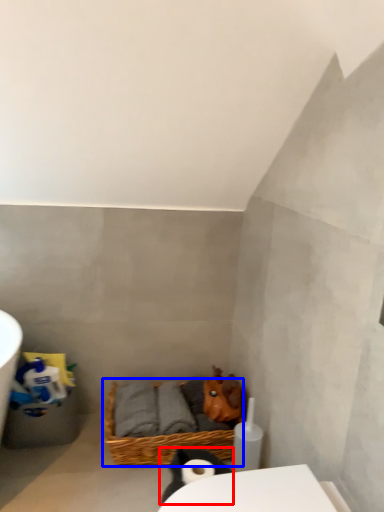
Question: Among these objects, which one is nearest to the camera, animal (highlighted by a red box) or basket (highlighted by a blue box)?

Choices:
 (A) animal
 (B) basket

Answer: (A)